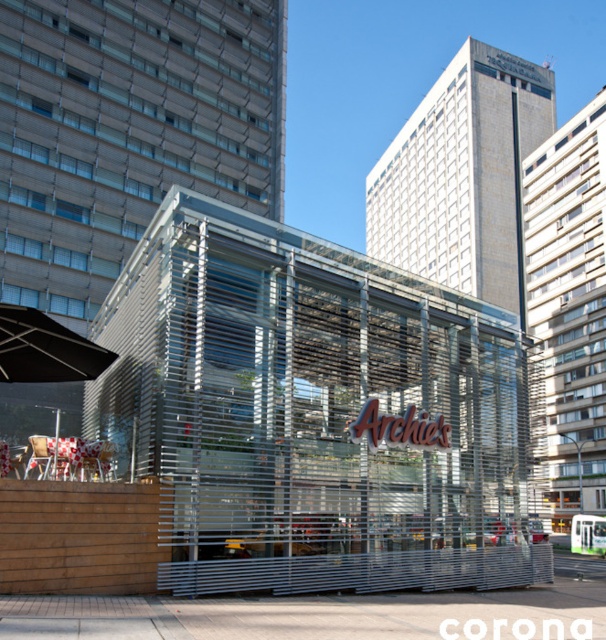
Is metallic silver chair at lower left thinner than white glossy chair at lower left?

In fact, metallic silver chair at lower left might be wider than white glossy chair at lower left.

Who is positioned more to the left, metallic silver chair at lower left or white glossy chair at lower left?

metallic silver chair at lower left

The image size is (606, 640). Describe the element at coordinates (48, 456) in the screenshot. I see `metallic silver chair at lower left` at that location.

Where is `metallic silver chair at lower left`? Image resolution: width=606 pixels, height=640 pixels. metallic silver chair at lower left is located at coordinates (48, 456).

Is point (32, 339) positioned behind point (99, 449)?

Yes.

Between black matte umbrella at left and white glossy chair at lower left, which one appears on the right side from the viewer's perspective?

Positioned to the right is white glossy chair at lower left.

The width and height of the screenshot is (606, 640). Describe the element at coordinates (44, 348) in the screenshot. I see `black matte umbrella at left` at that location.

At what (x,y) coordinates should I click in order to perform the action: click on black matte umbrella at left. Please return your answer as a coordinate pair (x, y). Looking at the image, I should click on (44, 348).

Does black matte umbrella at left have a greater height compared to metallic silver chair at lower left?

Correct, black matte umbrella at left is much taller as metallic silver chair at lower left.

Can you confirm if black matte umbrella at left is smaller than metallic silver chair at lower left?

Incorrect, black matte umbrella at left is not smaller in size than metallic silver chair at lower left.

What do you see at coordinates (44, 348) in the screenshot? Image resolution: width=606 pixels, height=640 pixels. I see `black matte umbrella at left` at bounding box center [44, 348].

Locate an element on the screen. The image size is (606, 640). black matte umbrella at left is located at coordinates (44, 348).